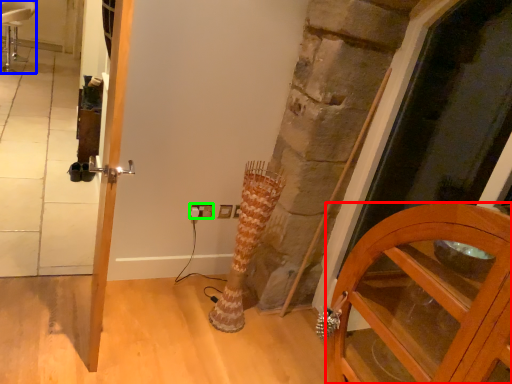
Question: Estimate the real-world distances between objects in this image. Which object is farther from cabinetry (highlighted by a red box), chair (highlighted by a blue box) or electric outlet (highlighted by a green box)?

Choices:
 (A) chair
 (B) electric outlet

Answer: (A)